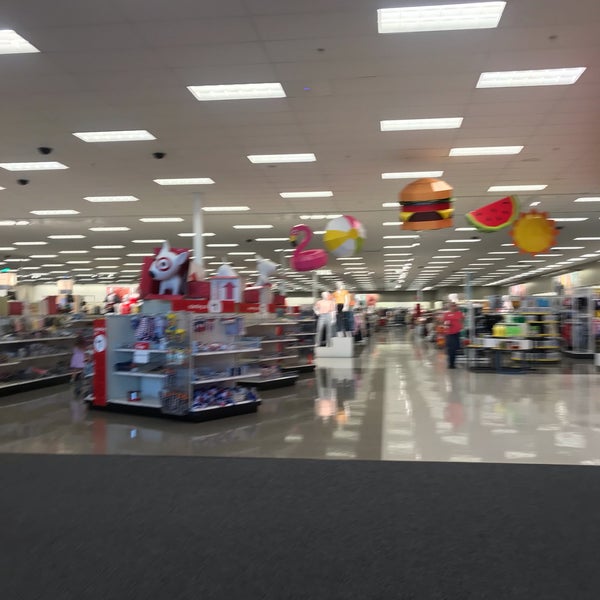
You are a GUI agent. You are given a task and a screenshot of the screen. Output one action in this format:
    pyautogui.click(x=<x>, y=<y>)
    Task: Click on the shelf 2
    The image size is (600, 600).
    Given the screenshot: What is the action you would take?
    click(x=281, y=344)